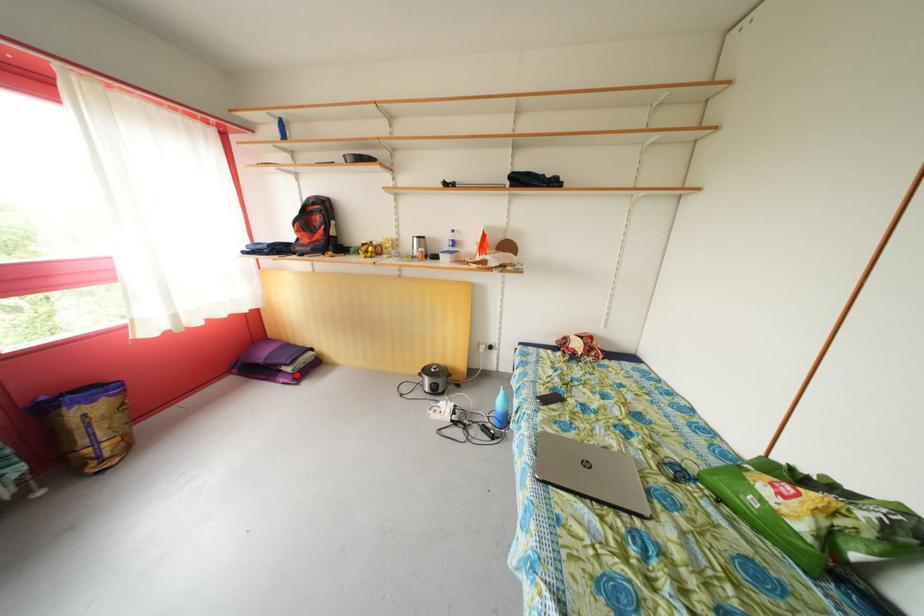
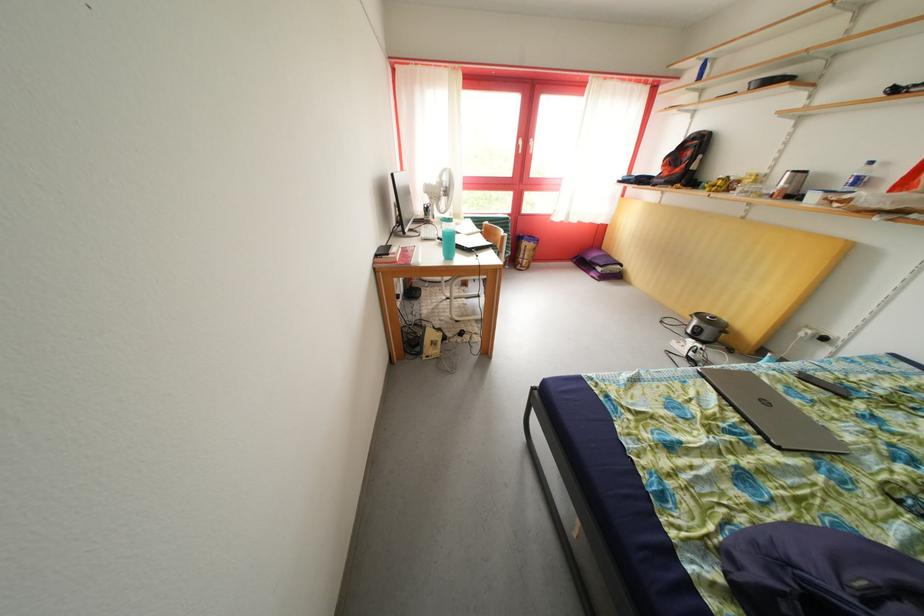
Question: A red point is marked in image1. In image2, is the corresponding 3D point closer to the camera or farther? Reply with the corresponding letter.

Choices:
 (A) The corresponding 3D point is closer.
 (B) The corresponding 3D point is farther.

Answer: (B)